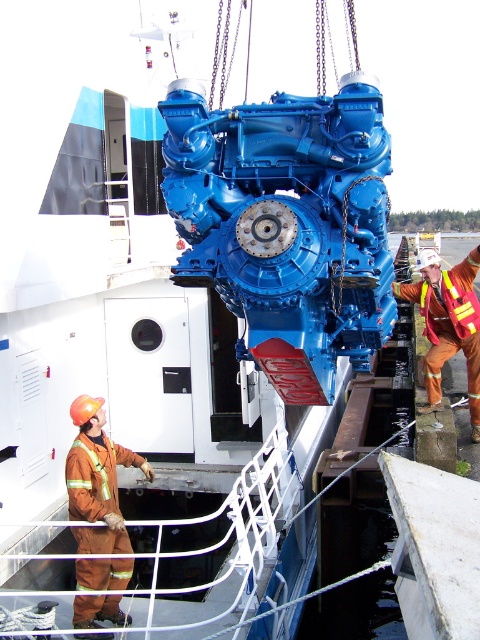
Consider the image. Who is lower down, brown reflective coveralls at lower left or reflective orange safety vest at right?

Positioned lower is brown reflective coveralls at lower left.

Does brown reflective coveralls at lower left have a lesser height compared to reflective orange safety vest at right?

Incorrect, brown reflective coveralls at lower left's height does not fall short of reflective orange safety vest at right's.

Does point (98, 513) lie in front of point (448, 280)?

Yes.

Locate an element on the screen. The width and height of the screenshot is (480, 640). brown reflective coveralls at lower left is located at coordinates (96, 480).

Which is above, orange reflective safety vest at center or reflective orange safety vest at right?

Positioned higher is orange reflective safety vest at center.

Can you confirm if orange reflective safety vest at center is taller than reflective orange safety vest at right?

Correct, orange reflective safety vest at center is much taller as reflective orange safety vest at right.

Is point (433, 320) in front of point (458, 307)?

No, (433, 320) is behind (458, 307).

Identify the location of orange reflective safety vest at center. (447, 324).

Can you confirm if brown reflective coveralls at lower left is shorter than orange reflective safety vest at center?

Indeed, brown reflective coveralls at lower left has a lesser height compared to orange reflective safety vest at center.

Is brown reflective coveralls at lower left smaller than orange reflective safety vest at center?

Correct, brown reflective coveralls at lower left occupies less space than orange reflective safety vest at center.

Which is in front, point (84, 486) or point (432, 356)?

Point (84, 486)

You are a GUI agent. You are given a task and a screenshot of the screen. Output one action in this format:
    pyautogui.click(x=<x>, y=<y>)
    Task: Click on the brown reflective coveralls at lower left
    
    Given the screenshot: What is the action you would take?
    pyautogui.click(x=96, y=480)